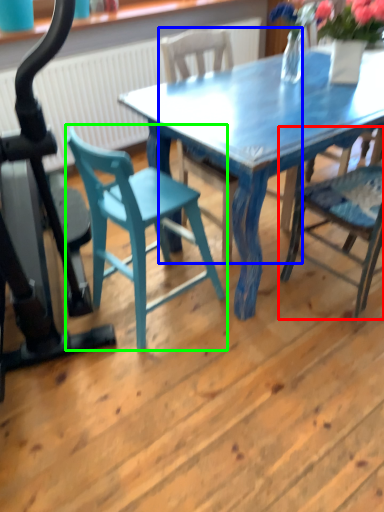
Question: Which object is the farthest from chair (highlighted by a red box)? Choose among these: chair (highlighted by a blue box) or chair (highlighted by a green box).

Choices:
 (A) chair
 (B) chair

Answer: (A)